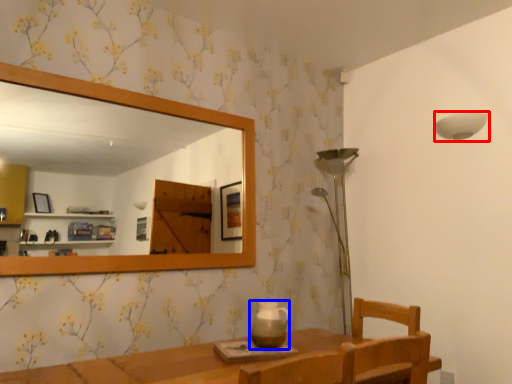
Question: Among these objects, which one is farthest to the camera, lamp (highlighted by a red box) or tea pot (highlighted by a blue box)?

Choices:
 (A) lamp
 (B) tea pot

Answer: (A)